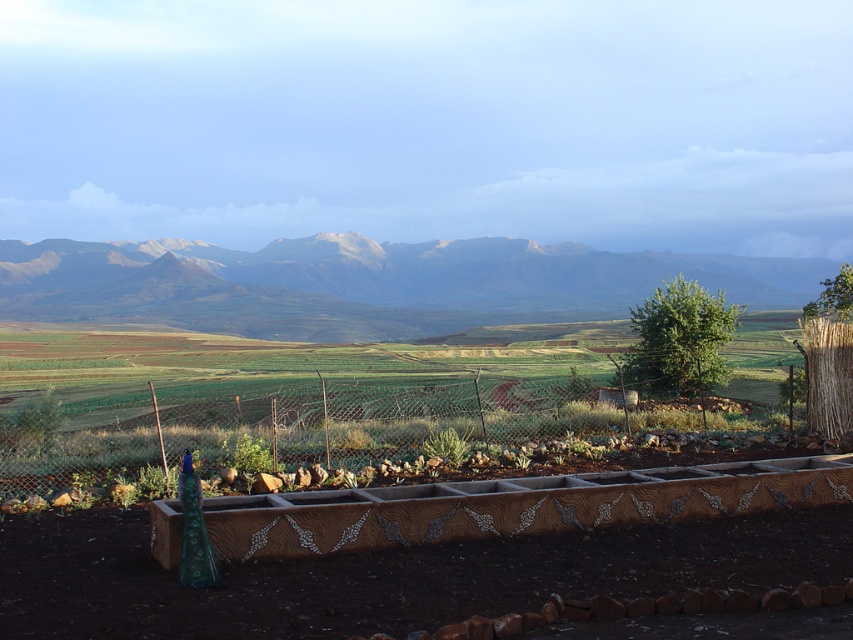
You are a gardener checking the plants in the garden. You see the metallic wire fence at lower center and the green succulent at center. Which object is closer to the ground?

The metallic wire fence at lower center is positioned under the green succulent at center, so the metallic wire fence at lower center is closer to the ground.

You are standing in the rural landscape and want to place a small flag at the point closer to you between point (595, 404) and point (418, 336). Which point should you choose?

You should choose point (595, 404) because it is closer to the viewer than point (418, 336).

You are standing in the rural landscape and want to take a photo of the gray rocky mountains at upper center. Based on their position, where should you aim your camera to capture them in the frame?

The gray rocky mountains at upper center are located at coordinates point (368, 284), so you should aim your camera towards the upper center area of the scene to capture them in the frame.